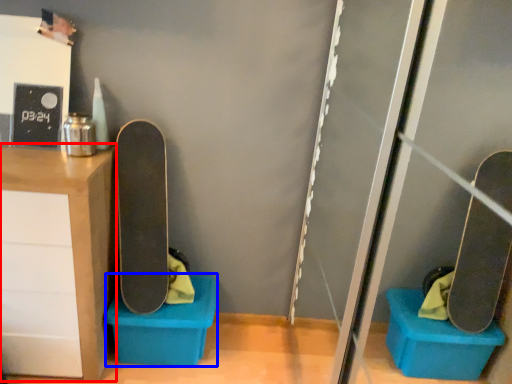
Question: Which object is further to the camera taking this photo, furniture (highlighted by a red box) or storage box (highlighted by a blue box)?

Choices:
 (A) furniture
 (B) storage box

Answer: (B)